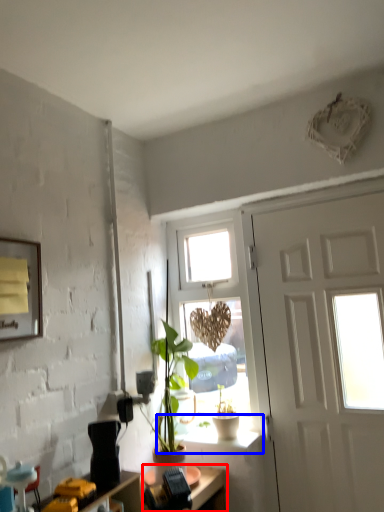
Question: Among these objects, which one is farthest to the camera, desk (highlighted by a red box) or window sill (highlighted by a blue box)?

Choices:
 (A) desk
 (B) window sill

Answer: (B)